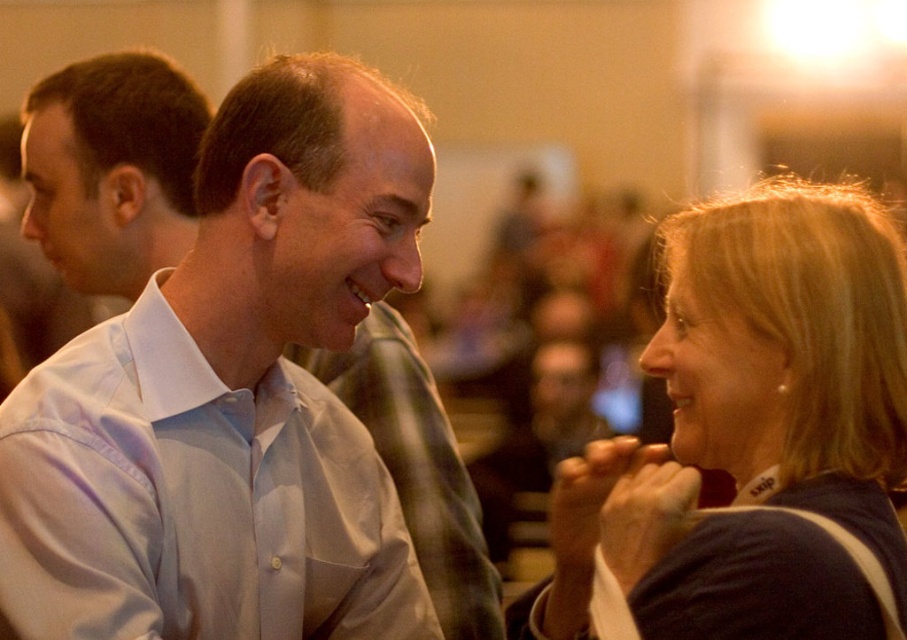
In the scene shown: You are a photographer adjusting the focus of your camera. The camera has a focus point at coordinates 0.662, 0.843. Which object in the scene should you focus on to capture the blonde hair at upper right clearly?

The focus point at coordinates (764, 422) is exactly where the blonde hair at upper right is located, so focusing there will ensure the blonde hair at upper right is clear.

You are standing at the origin point in the image and want to reach the point labeled as point (56,355) first. However, there is an obstacle at point (758,468). Can you reach your destination without going around the obstacle?

Point (758,468) is in front of point (56,355), so you cannot reach point (56,355) without going around the obstacle at point (758,468).

You are a photographer adjusting the camera settings to ensure both the blonde hair at upper right and the white cotton dress shirt at center are in focus. Based on their positions, which subject should you prioritize focusing on first to maintain depth of field?

The blonde hair at upper right is taller than the white cotton dress shirt at center, so you should prioritize focusing on the taller subject first to ensure both are in focus.